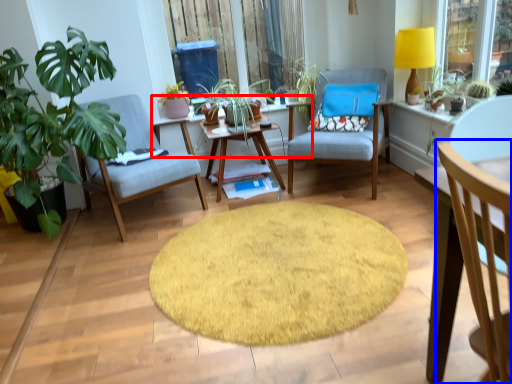
Question: Which object appears closest to the camera in this image, table (highlighted by a red box) or chair (highlighted by a blue box)?

Choices:
 (A) table
 (B) chair

Answer: (B)